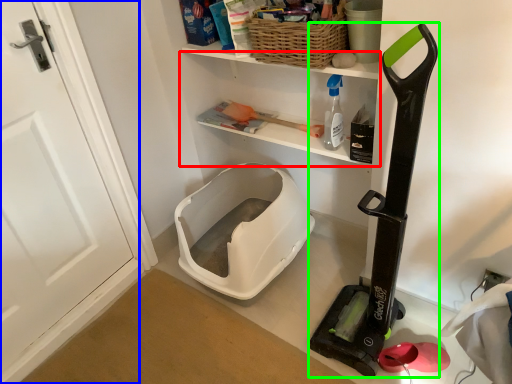
Question: Which object is the closest to the shelf (highlighted by a red box)? Choose among these: door (highlighted by a blue box) or appliance (highlighted by a green box).

Choices:
 (A) door
 (B) appliance

Answer: (B)